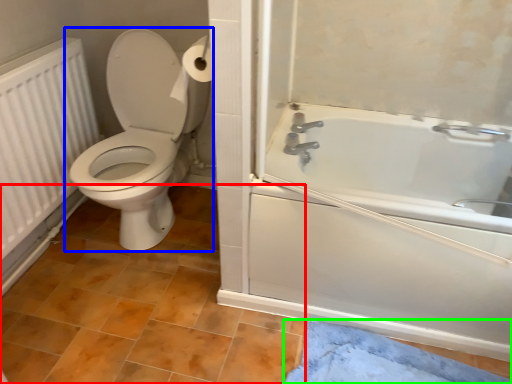
Question: Estimate the real-world distances between objects in this image. Which object is closer to tile (highlighted by a red box), toilet (highlighted by a blue box) or bath mat (highlighted by a green box)?

Choices:
 (A) toilet
 (B) bath mat

Answer: (A)